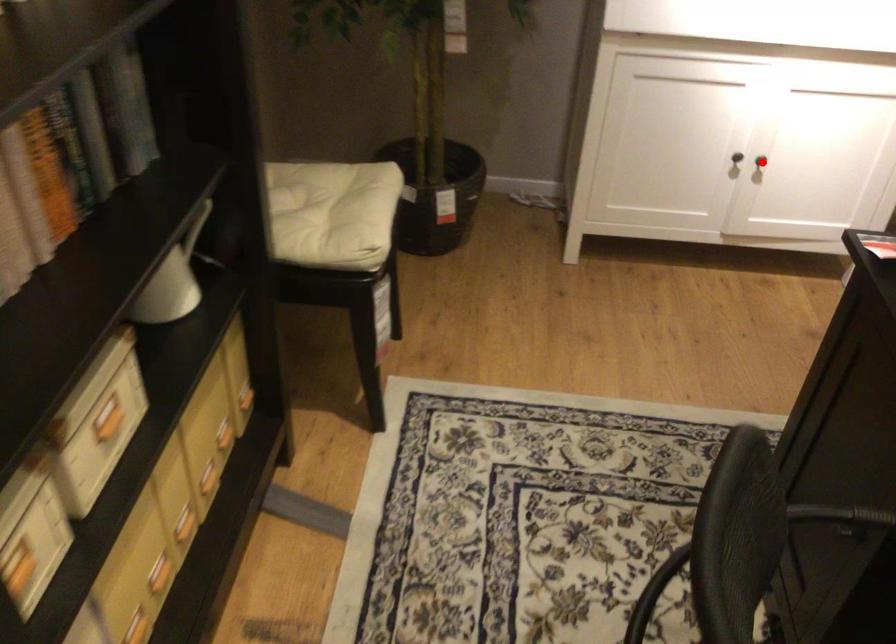
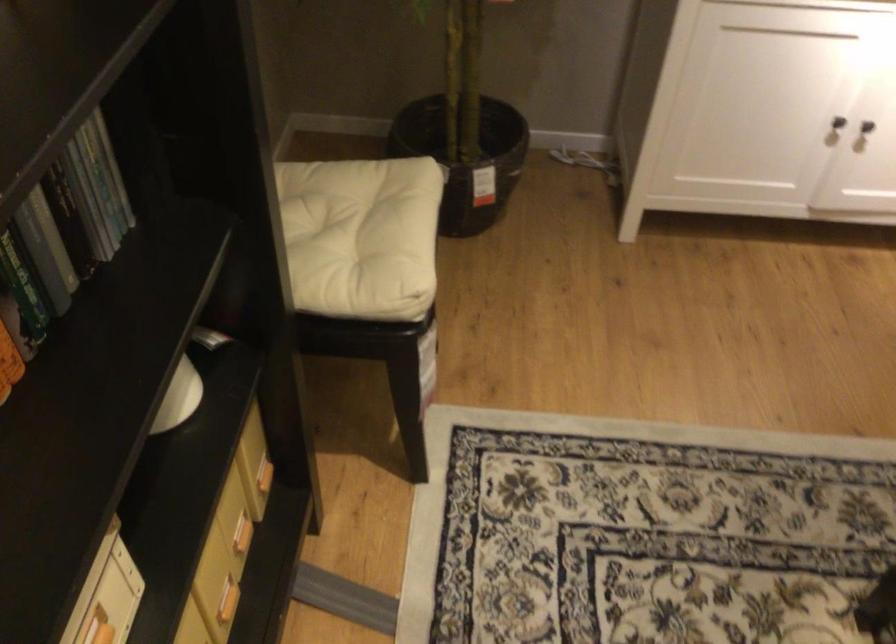
Question: I am providing you with two images of the same scene from different viewpoints. Given a red point in image1, look at the same physical point in image2. Is it:

Choices:
 (A) Closer to the viewpoint
 (B) Farther from the viewpoint

Answer: (A)